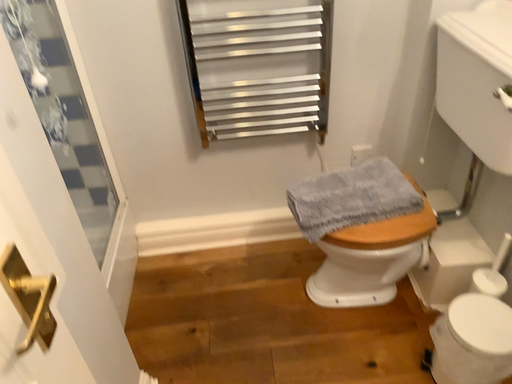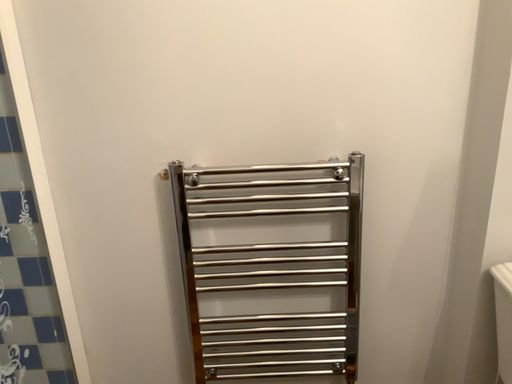
Question: Which way did the camera rotate in the video?

Choices:
 (A) rotated downward
 (B) rotated upward

Answer: (B)